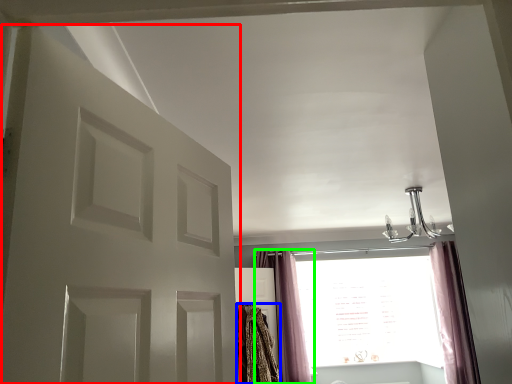
Question: Considering the real-world distances, which object is closest to door (highlighted by a red box)? blanket (highlighted by a blue box) or curtain (highlighted by a green box).

Choices:
 (A) blanket
 (B) curtain

Answer: (A)